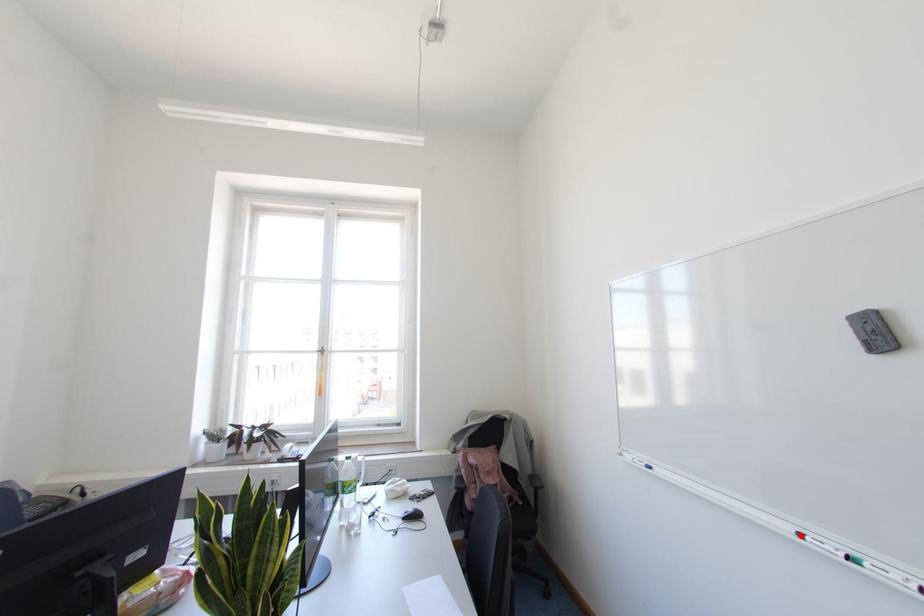
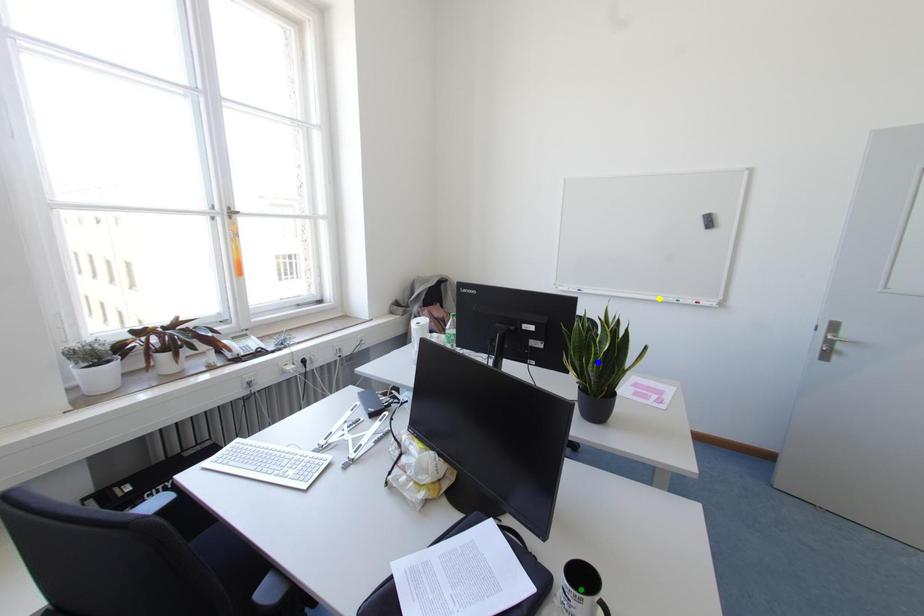
Question: I am providing you with two images of the same scene from different viewpoints. A red point is marked on the first image. You are given multiple points on the second image. In image 2, which mark is for the same physical point as the one in image 1?

Choices:
 (A) green point
 (B) yellow point
 (C) blue point

Answer: (B)